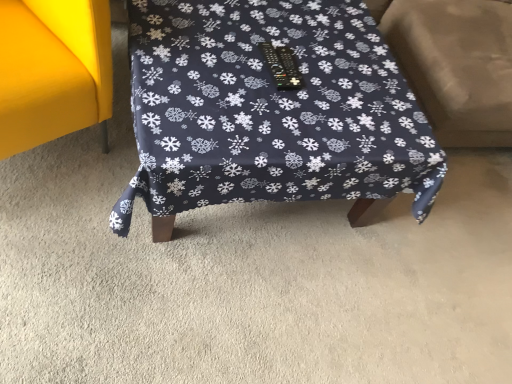
Find the location of a particular element. matte yellow sofa at left, which appears as the 2th furniture when viewed from the right is located at coordinates click(x=52, y=70).

Measure the distance between point (9, 121) and camera.

Point (9, 121) is 3.88 feet from camera.

The image size is (512, 384). What are the coordinates of `beige fabric swivel chair at right` in the screenshot? It's located at (456, 65).

Is dark blue fabric table at center, the 1th furniture from the right, oriented away from beige fabric swivel chair at right?

No, dark blue fabric table at center, the 1th furniture from the right, is not facing the opposite direction of beige fabric swivel chair at right.

Which of these two, dark blue fabric table at center, the 1th furniture from the right, or beige fabric swivel chair at right, is thinner?

With smaller width is beige fabric swivel chair at right.

Is dark blue fabric table at center, which is the second furniture from left to right, next to beige fabric swivel chair at right and touching it?

No, dark blue fabric table at center, which is the second furniture from left to right, is not beside beige fabric swivel chair at right.

Considering the relative sizes of dark blue fabric table at center, which is the second furniture from left to right, and beige fabric swivel chair at right in the image provided, is dark blue fabric table at center, which is the second furniture from left to right, bigger than beige fabric swivel chair at right?

Incorrect, dark blue fabric table at center, which is the second furniture from left to right, is not larger than beige fabric swivel chair at right.

From the image's perspective, is beige fabric swivel chair at right on matte yellow sofa at left, acting as the 1th furniture starting from the left?

Yes, from the image's perspective, beige fabric swivel chair at right is over matte yellow sofa at left, acting as the 1th furniture starting from the left.

Is beige fabric swivel chair at right wider or thinner than matte yellow sofa at left, acting as the 1th furniture starting from the left?

In the image, beige fabric swivel chair at right appears to be wider than matte yellow sofa at left, acting as the 1th furniture starting from the left.

Image resolution: width=512 pixels, height=384 pixels. Find the location of `the 1st furniture below the beige fabric swivel chair at right (from a real-world perspective)`. the 1st furniture below the beige fabric swivel chair at right (from a real-world perspective) is located at coordinates (52, 70).

Which object is positioned more to the right, beige fabric swivel chair at right or matte yellow sofa at left, acting as the 1th furniture starting from the left?

beige fabric swivel chair at right is more to the right.

From a real-world perspective, who is located lower, matte yellow sofa at left, which appears as the 2th furniture when viewed from the right, or dark blue fabric table at center, the 1th furniture from the right?

dark blue fabric table at center, the 1th furniture from the right.

Where is `furniture in front of the dark blue fabric table at center, which is the second furniture from left to right`? Image resolution: width=512 pixels, height=384 pixels. furniture in front of the dark blue fabric table at center, which is the second furniture from left to right is located at coordinates (52, 70).

How different are the orientations of matte yellow sofa at left, acting as the 1th furniture starting from the left, and dark blue fabric table at center, which is the second furniture from left to right, in degrees?

The facing directions of matte yellow sofa at left, acting as the 1th furniture starting from the left, and dark blue fabric table at center, which is the second furniture from left to right, are 29.1 degrees apart.

Considering the relative positions of dark blue fabric table at center, the 1th furniture from the right, and matte yellow sofa at left, acting as the 1th furniture starting from the left, in the image provided, is dark blue fabric table at center, the 1th furniture from the right, to the right of matte yellow sofa at left, acting as the 1th furniture starting from the left, from the viewer's perspective?

Yes, dark blue fabric table at center, the 1th furniture from the right, is to the right of matte yellow sofa at left, acting as the 1th furniture starting from the left.

From a real-world perspective, is dark blue fabric table at center, the 1th furniture from the right, on matte yellow sofa at left, acting as the 1th furniture starting from the left?

No, from a real-world perspective, dark blue fabric table at center, the 1th furniture from the right, is not on top of matte yellow sofa at left, acting as the 1th furniture starting from the left.

Locate an element on the screen. furniture located on the right of matte yellow sofa at left, acting as the 1th furniture starting from the left is located at coordinates (270, 111).

From the image's perspective, who appears lower, dark blue fabric table at center, which is the second furniture from left to right, or matte yellow sofa at left, acting as the 1th furniture starting from the left?

dark blue fabric table at center, which is the second furniture from left to right, appears lower in the image.

Identify the location of the 1st furniture in front of the beige fabric swivel chair at right. (270, 111).

Does beige fabric swivel chair at right appear on the right side of dark blue fabric table at center, which is the second furniture from left to right?

Correct, you'll find beige fabric swivel chair at right to the right of dark blue fabric table at center, which is the second furniture from left to right.

Considering the sizes of objects beige fabric swivel chair at right and dark blue fabric table at center, which is the second furniture from left to right, in the image provided, who is thinner, beige fabric swivel chair at right or dark blue fabric table at center, which is the second furniture from left to right,?

beige fabric swivel chair at right is thinner.

Based on the photo, is beige fabric swivel chair at right completely or partially outside of dark blue fabric table at center, which is the second furniture from left to right?

Yes, beige fabric swivel chair at right is not within dark blue fabric table at center, which is the second furniture from left to right.

Is matte yellow sofa at left, which appears as the 2th furniture when viewed from the right, inside or outside of beige fabric swivel chair at right?

matte yellow sofa at left, which appears as the 2th furniture when viewed from the right, exists outside the volume of beige fabric swivel chair at right.

Considering the sizes of objects matte yellow sofa at left, which appears as the 2th furniture when viewed from the right, and beige fabric swivel chair at right in the image provided, who is wider, matte yellow sofa at left, which appears as the 2th furniture when viewed from the right, or beige fabric swivel chair at right?

A: beige fabric swivel chair at right is wider.

Considering the points (19, 152) and (494, 138), which point is behind, point (19, 152) or point (494, 138)?

Positioned behind is point (494, 138).

In the scene shown: Considering the positions of objects matte yellow sofa at left, which appears as the 2th furniture when viewed from the right, and beige fabric swivel chair at right in the image provided, who is more to the right, matte yellow sofa at left, which appears as the 2th furniture when viewed from the right, or beige fabric swivel chair at right?

From the viewer's perspective, beige fabric swivel chair at right appears more on the right side.

Identify the location of the 1st furniture to the left of the beige fabric swivel chair at right, starting your count from the anchor. (270, 111).

Find the location of `swivel chair that appears on the right of matte yellow sofa at left, acting as the 1th furniture starting from the left`. swivel chair that appears on the right of matte yellow sofa at left, acting as the 1th furniture starting from the left is located at coordinates (456, 65).

When comparing their distances from beige fabric swivel chair at right, does matte yellow sofa at left, acting as the 1th furniture starting from the left, or dark blue fabric table at center, the 1th furniture from the right, seem further?

matte yellow sofa at left, acting as the 1th furniture starting from the left.

Which object lies nearer to the anchor point dark blue fabric table at center, which is the second furniture from left to right, beige fabric swivel chair at right or matte yellow sofa at left, which appears as the 2th furniture when viewed from the right?

matte yellow sofa at left, which appears as the 2th furniture when viewed from the right, lies closer to dark blue fabric table at center, which is the second furniture from left to right, than the other object.

Estimate the real-world distances between objects in this image. Which object is further from matte yellow sofa at left, which appears as the 2th furniture when viewed from the right, beige fabric swivel chair at right or dark blue fabric table at center, the 1th furniture from the right?

beige fabric swivel chair at right.

From the image, which object appears to be farther from matte yellow sofa at left, acting as the 1th furniture starting from the left, dark blue fabric table at center, the 1th furniture from the right, or beige fabric swivel chair at right?

beige fabric swivel chair at right is positioned further to the anchor matte yellow sofa at left, acting as the 1th furniture starting from the left.

Considering their positions, is dark blue fabric table at center, which is the second furniture from left to right, positioned closer to beige fabric swivel chair at right than matte yellow sofa at left, which appears as the 2th furniture when viewed from the right?

Based on the image, dark blue fabric table at center, which is the second furniture from left to right, appears to be nearer to beige fabric swivel chair at right.

When comparing their distances from dark blue fabric table at center, the 1th furniture from the right, does matte yellow sofa at left, which appears as the 2th furniture when viewed from the right, or beige fabric swivel chair at right seem further?

beige fabric swivel chair at right is further to dark blue fabric table at center, the 1th furniture from the right.

Where is `furniture between matte yellow sofa at left, which appears as the 2th furniture when viewed from the right, and beige fabric swivel chair at right`? The width and height of the screenshot is (512, 384). furniture between matte yellow sofa at left, which appears as the 2th furniture when viewed from the right, and beige fabric swivel chair at right is located at coordinates (270, 111).